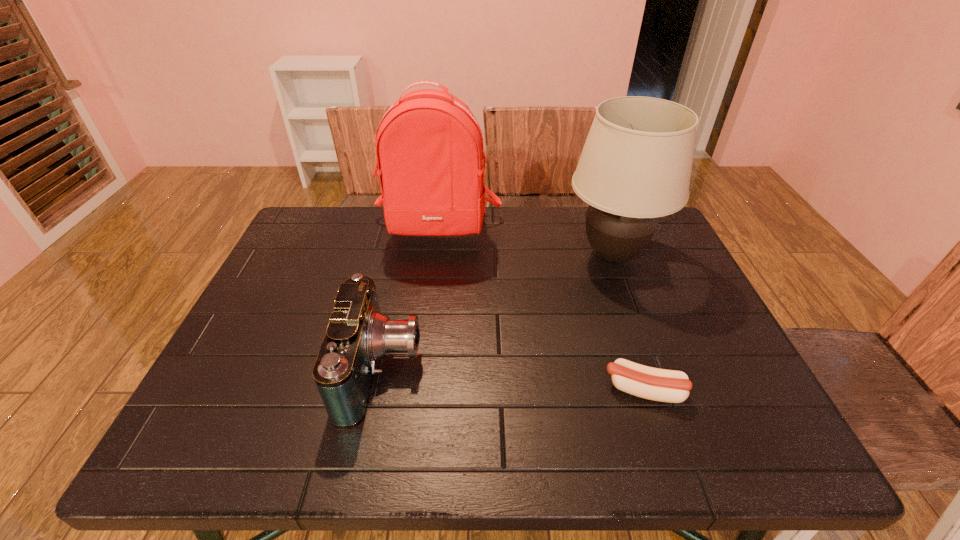
Identify the location of object located in the near edge section of the desktop. (358, 335).

I want to click on lampshade situated at the right edge, so click(635, 166).

You are a GUI agent. You are given a task and a screenshot of the screen. Output one action in this format:
    pyautogui.click(x=<x>, y=<y>)
    Task: Click on the sausage located at the right edge
    This screenshot has height=540, width=960.
    Given the screenshot: What is the action you would take?
    pyautogui.click(x=663, y=385)

The image size is (960, 540). In order to click on object present at the far right corner in this screenshot , I will do `click(635, 166)`.

The image size is (960, 540). I want to click on vacant point at the far edge, so click(x=352, y=235).

In the image, there is a desktop. Where is `free space at the near edge`? Image resolution: width=960 pixels, height=540 pixels. free space at the near edge is located at coordinates (491, 455).

The height and width of the screenshot is (540, 960). Identify the location of free spot at the right edge of the desktop. (638, 276).

Identify the location of free space at the far left corner of the desktop. (335, 213).

The image size is (960, 540). In the image, there is a desktop. Find the location of `free region at the near right corner`. free region at the near right corner is located at coordinates (765, 440).

This screenshot has width=960, height=540. I want to click on empty location between the backpack and the lampshade, so click(x=525, y=242).